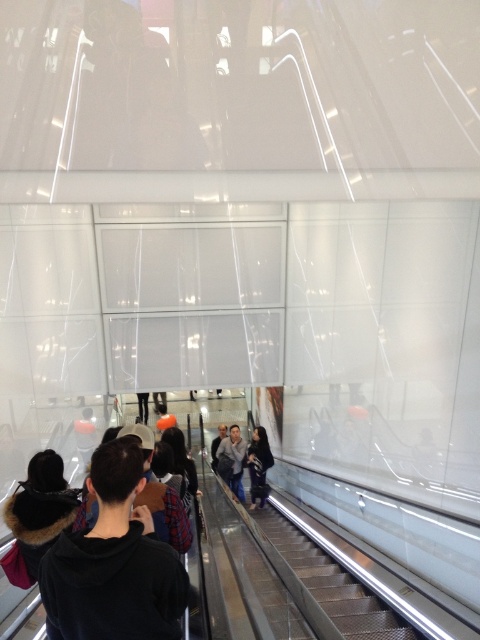
The width and height of the screenshot is (480, 640). What do you see at coordinates (259, 465) in the screenshot?
I see `dark gray sweater at center` at bounding box center [259, 465].

Is dark gray sweater at center positioned at the back of dark gray jacket at center?

No, it is not.

Which is behind, point (255, 428) or point (218, 436)?

The point (218, 436) is behind.

Identify the location of dark gray sweater at center. The width and height of the screenshot is (480, 640). (259, 465).

Is metallic silver escalator at center wider than black fur-lined coat at lower left?

Indeed, metallic silver escalator at center has a greater width compared to black fur-lined coat at lower left.

Between metallic silver escalator at center and black fur-lined coat at lower left, which one is positioned higher?

black fur-lined coat at lower left is higher up.

Identify the location of metallic silver escalator at center. Image resolution: width=480 pixels, height=640 pixels. (333, 584).

Who is more forward, (321, 561) or (212, 444)?

Positioned in front is point (321, 561).

Is point (339, 577) positioned in front of point (226, 426)?

That is True.

Which is behind, point (283, 531) or point (211, 465)?

The point (211, 465) is behind.

Where is `metallic silver escalator at center`? This screenshot has height=640, width=480. metallic silver escalator at center is located at coordinates (333, 584).